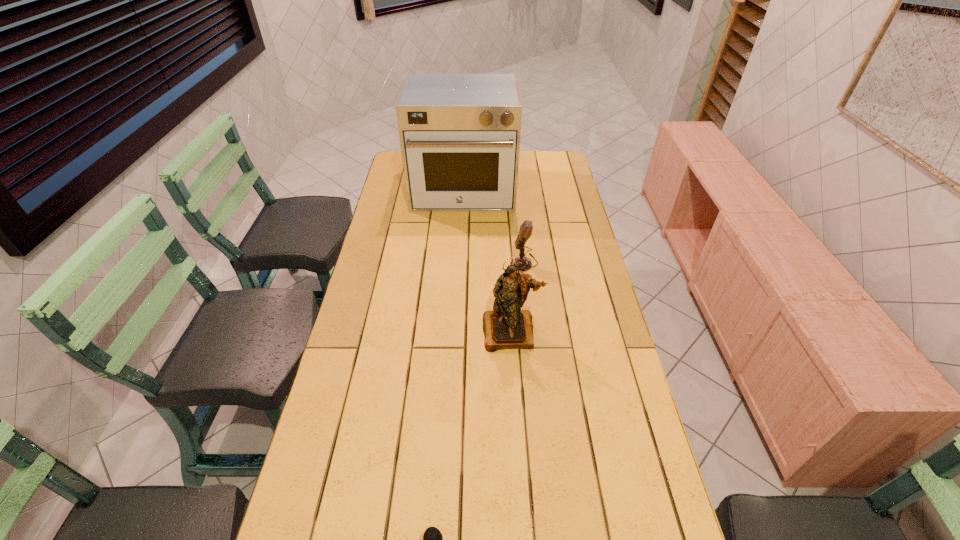
This screenshot has height=540, width=960. I want to click on empty location between the third nearest object and the toaster oven, so click(x=493, y=226).

At what (x,y) coordinates should I click in order to perform the action: click on object that can be found as the second closest to the nearest object. Please return your answer as a coordinate pair (x, y). This screenshot has width=960, height=540. Looking at the image, I should click on (521, 263).

What are the coordinates of `object that is the second closest to the taller microphone` in the screenshot? It's located at (459, 134).

What are the coordinates of `free location that satisfies the following two spatial constraints: 1. on the front-facing side of the right microphone; 2. on the front-facing side of the figurine` in the screenshot? It's located at 532,332.

I want to click on free space that satisfies the following two spatial constraints: 1. on the front-facing side of the third tallest object; 2. on the front-facing side of the figurine, so click(532, 332).

The width and height of the screenshot is (960, 540). In order to click on vacant point that satisfies the following two spatial constraints: 1. on the front-facing side of the right microphone; 2. on the front-facing side of the third farthest object in this screenshot , I will do pyautogui.click(x=532, y=332).

Find the location of a particular element. This screenshot has height=540, width=960. vacant region that satisfies the following two spatial constraints: 1. on the front-facing side of the third tallest object; 2. on the front-facing side of the third farthest object is located at coordinates (532, 332).